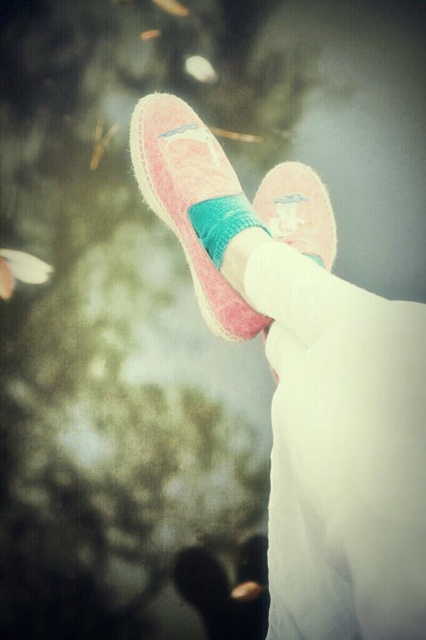
You are a photographer adjusting your camera settings to focus on two points in the image. The first point is point (x=233, y=186) and the second is point (x=204, y=240). Which point should you focus on first if you want to ensure the closest object is sharp?

You should focus on point (x=233, y=186) first because it is closer to the camera than point (x=204, y=240), ensuring the closest object is sharp.

You are a photographer aiming to capture a detailed shot of the pink suede shoes at center. Given that your camera has a minimum focusing distance of 10 inches, will you need to move closer or farther away to ensure the shoes are in focus?

The pink suede shoes at center is 9.80 inches away from the viewer, which is closer than the camera minimum focusing distance of 10 inches. Therefore, you need to move farther away to ensure the shoes are in focus.

Based on the photo, you are designing a shoe display and need to place a teal soft sock at center on a shelf. The shelf has a width of 10 cm. Can the pink suede shoe at center, which is larger than the sock, also fit on the same shelf without overlapping?

The pink suede shoe at center is bigger than the teal soft sock at center. Since the shelf is only 10 cm wide, it may not be sufficient to accommodate both items without overlapping. You should check the exact dimensions of both items to ensure they fit together.